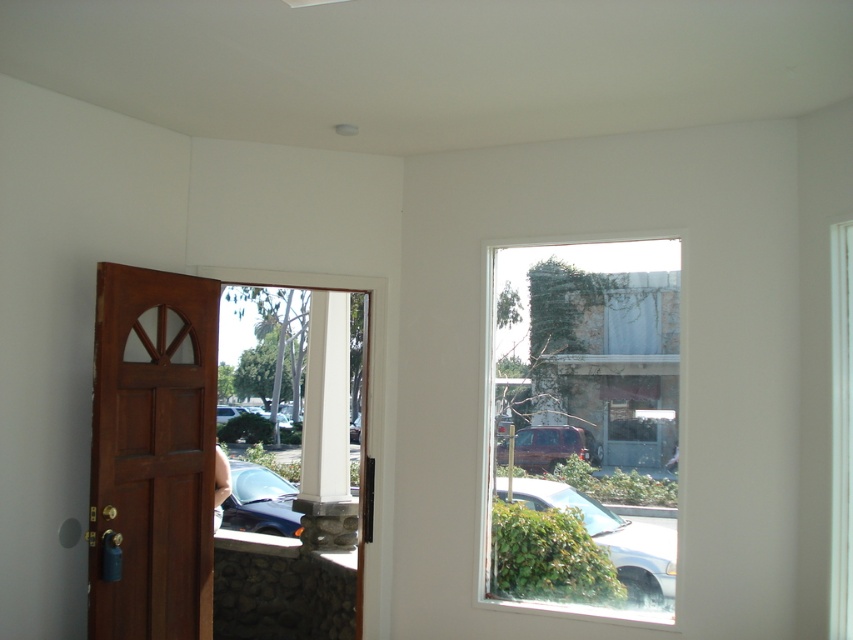
Can you confirm if shiny blue car at lower left is taller than matte red suv at center?

Yes, shiny blue car at lower left is taller than matte red suv at center.

Between shiny blue car at lower left and matte red suv at center, which one is positioned lower?

shiny blue car at lower left is lower down.

This screenshot has height=640, width=853. What do you see at coordinates (259, 500) in the screenshot?
I see `shiny blue car at lower left` at bounding box center [259, 500].

Where is `shiny blue car at lower left`? shiny blue car at lower left is located at coordinates (259, 500).

Is point (637, 412) closer to camera compared to point (643, 566)?

That is False.

Who is more forward, (x=526, y=536) or (x=552, y=492)?

Positioned in front is point (x=552, y=492).

I want to click on stone textured wall at upper right, so click(x=592, y=392).

How distant is brown wooden door at left from shiny blue car at lower left?

A distance of 3.22 meters exists between brown wooden door at left and shiny blue car at lower left.

Does brown wooden door at left have a smaller size compared to shiny blue car at lower left?

Actually, brown wooden door at left might be larger than shiny blue car at lower left.

Which is behind, point (109, 353) or point (277, 484)?

The point (277, 484) is behind.

You are a GUI agent. You are given a task and a screenshot of the screen. Output one action in this format:
    pyautogui.click(x=<x>, y=<y>)
    Task: Click on the brown wooden door at left
    
    Given the screenshot: What is the action you would take?
    pyautogui.click(x=152, y=454)